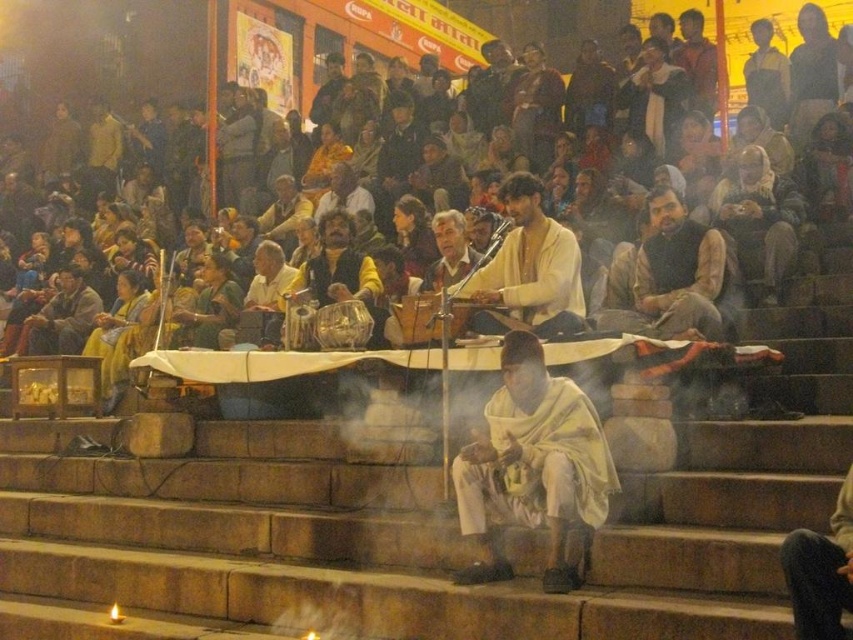
Question: Considering the relative positions of dark brown leather jacket at center and dark brown leather jacket at lower left in the image provided, where is dark brown leather jacket at center located with respect to dark brown leather jacket at lower left?

Choices:
 (A) below
 (B) above

Answer: (B)

Question: Considering the real-world distances, which object is closest to the white clothed man at center?

Choices:
 (A) dark brown leather jacket at center
 (B) light brown fabric at center
 (C) dark brown leather jacket at lower left

Answer: (B)

Question: Estimate the real-world distances between objects in this image. Which object is farther from the white clothed man at center?

Choices:
 (A) dark brown leather jacket at center
 (B) light brown fabric at center

Answer: (A)

Question: In this image, where is dark brown leather jacket at center located relative to dark brown leather jacket at lower left?

Choices:
 (A) right
 (B) left

Answer: (A)

Question: Estimate the real-world distances between objects in this image. Which object is farther from the light brown fabric at center?

Choices:
 (A) dark brown leather jacket at center
 (B) white clothed man at center

Answer: (B)

Question: Is white clothed man at center positioned in front of dark brown leather jacket at lower left?

Choices:
 (A) yes
 (B) no

Answer: (A)